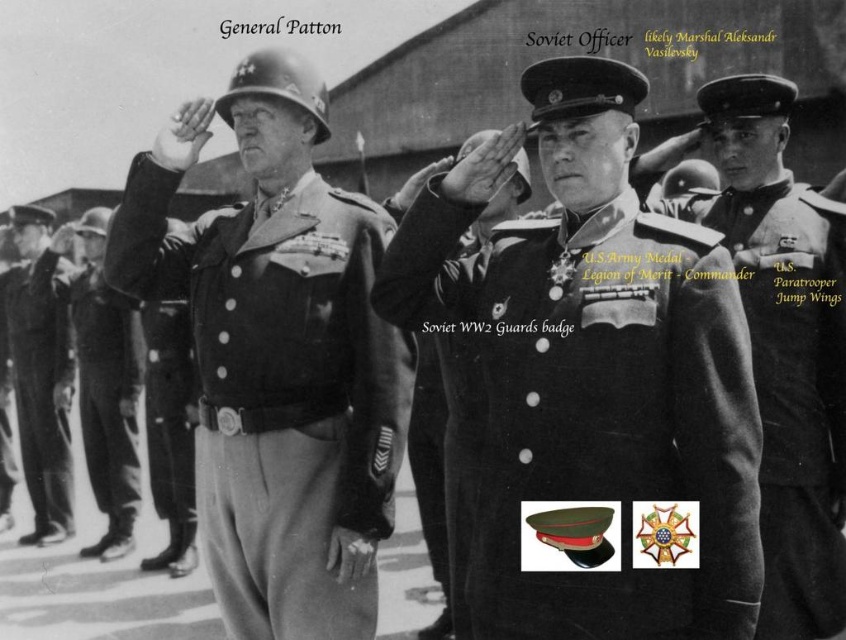
You are a military historian examining this photograph. You notice two items at the center of the image. Which one is located to the right of the other? The items are the matte black helmet at center and the smooth black uniform at center.

The matte black helmet at center is positioned on the right side of the smooth black uniform at center.

You are a photographer standing 1.8 meters tall. You are holding a camera and want to take a photo of the dark uniform at center. If you extend your arm fully, which reaches 1.2 meters from your chest, will you be able to take the photo without moving closer?

The distance between you and the dark uniform at center is 3.70 meters. When you extend your arm fully, the maximum reach is 1.8m height plus 1.2m arm extension equals 3.0 meters. Since 3.0 meters is less than 3.70 meters, you cannot take the photo without moving closer.